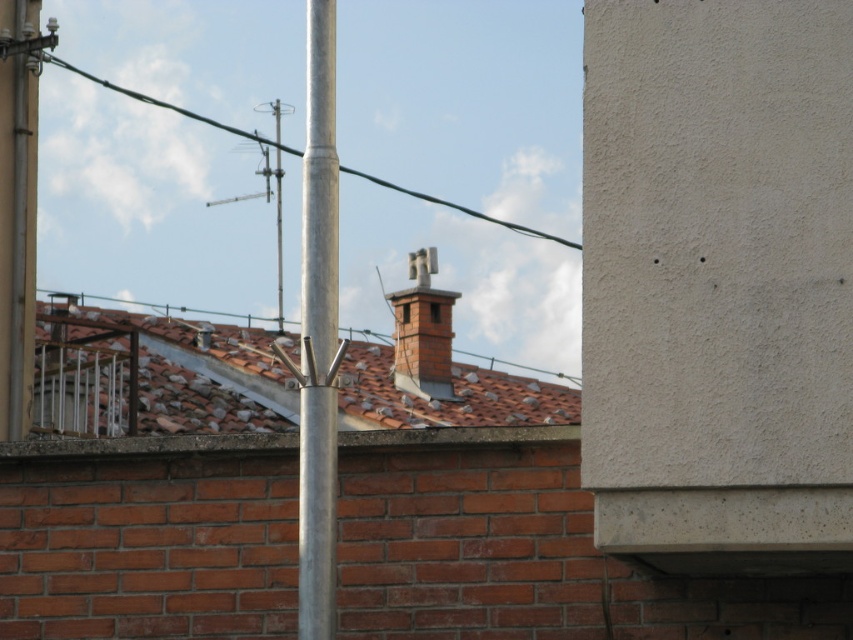
Question: Which point appears farthest from the camera in this image?

Choices:
 (A) (549, 234)
 (B) (317, 179)

Answer: (A)

Question: Which of the following is the closest to the observer?

Choices:
 (A) silver metallic pole at center
 (B) brick chimney at center
 (C) green wire at upper center

Answer: (A)

Question: Does silver metallic pole at center appear on the right side of brick chimney at center?

Choices:
 (A) yes
 (B) no

Answer: (A)

Question: Can you confirm if silver metallic pole at center is smaller than green wire at upper center?

Choices:
 (A) no
 (B) yes

Answer: (B)

Question: Is silver metallic pole at center positioned in front of green wire at upper center?

Choices:
 (A) no
 (B) yes

Answer: (B)

Question: Which point is closer to the camera taking this photo?

Choices:
 (A) (117, 92)
 (B) (312, 314)

Answer: (B)